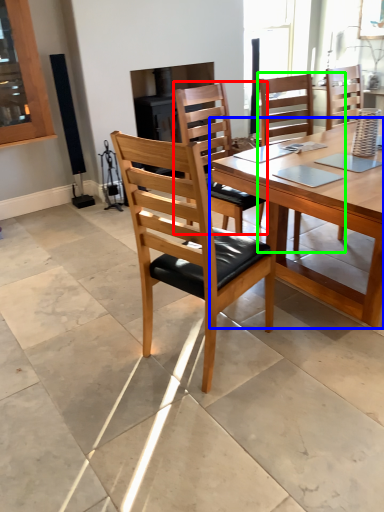
Question: Based on their relative distances, which object is farther from chair (highlighted by a red box)? Choose from kitchen & dining room table (highlighted by a blue box) and chair (highlighted by a green box).

Choices:
 (A) kitchen & dining room table
 (B) chair

Answer: (B)